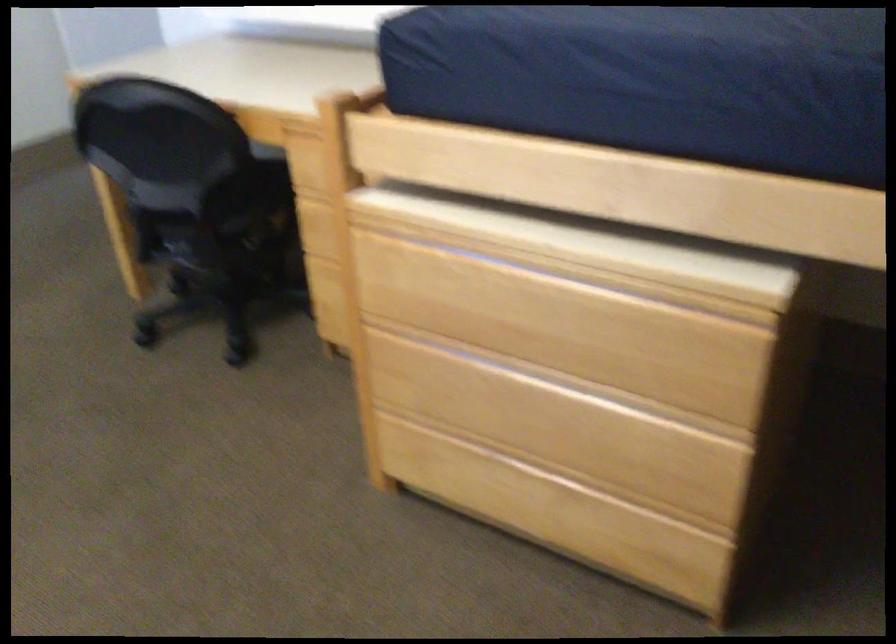
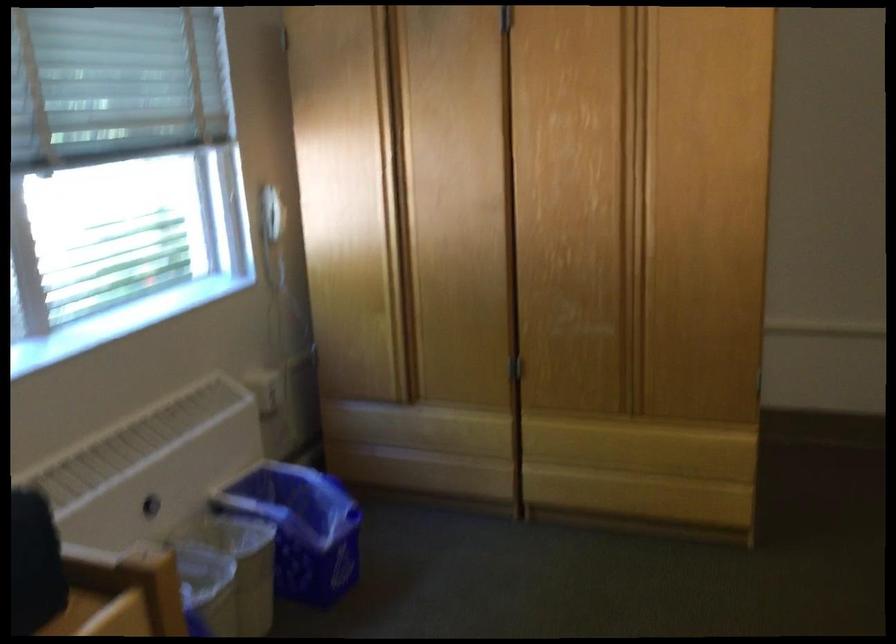
Question: The first image is from the beginning of the video and the second image is from the end. How did the camera likely rotate when shooting the video?

Choices:
 (A) Left
 (B) Right
 (C) Up
 (D) Down

Answer: (A)